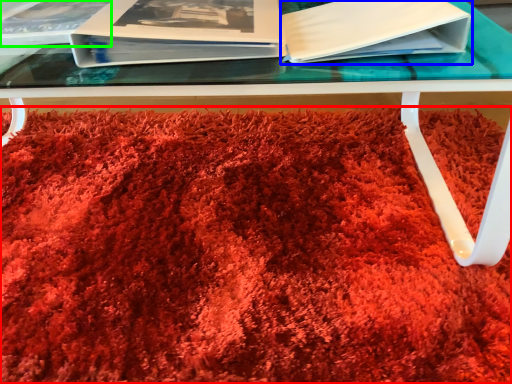
Question: Based on their relative distances, which object is nearer to blanket (highlighted by a red box)? Choose from paperback book (highlighted by a blue box) and album (highlighted by a green box).

Choices:
 (A) paperback book
 (B) album

Answer: (A)